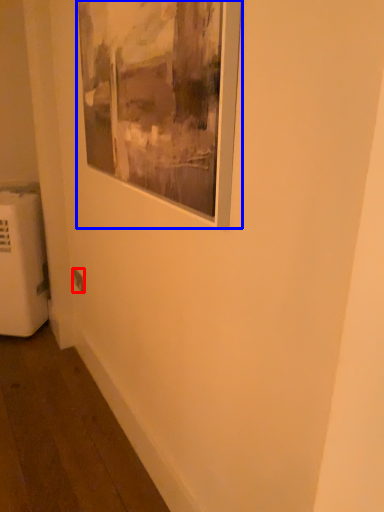
Question: Which object appears closest to the camera in this image, electric outlet (highlighted by a red box) or picture frame (highlighted by a blue box)?

Choices:
 (A) electric outlet
 (B) picture frame

Answer: (B)